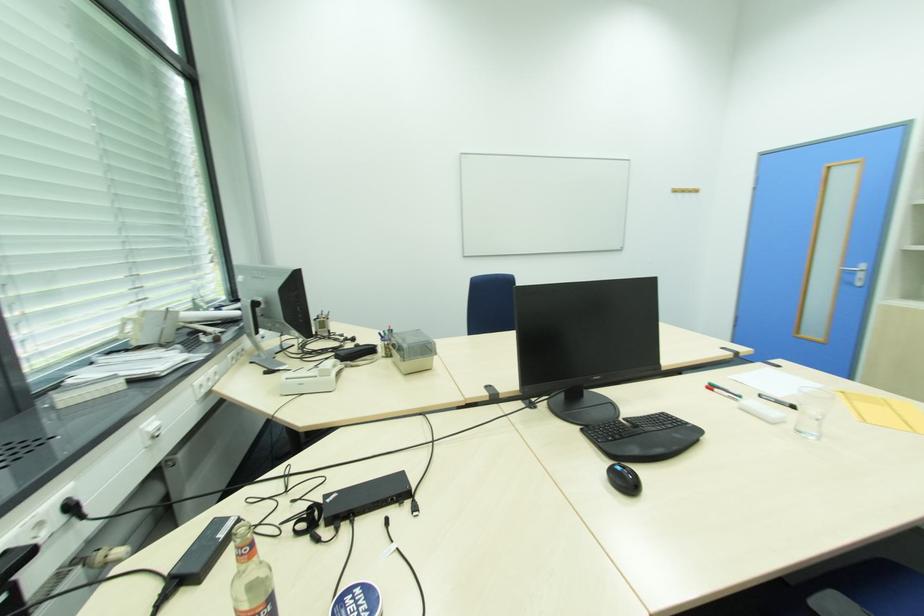
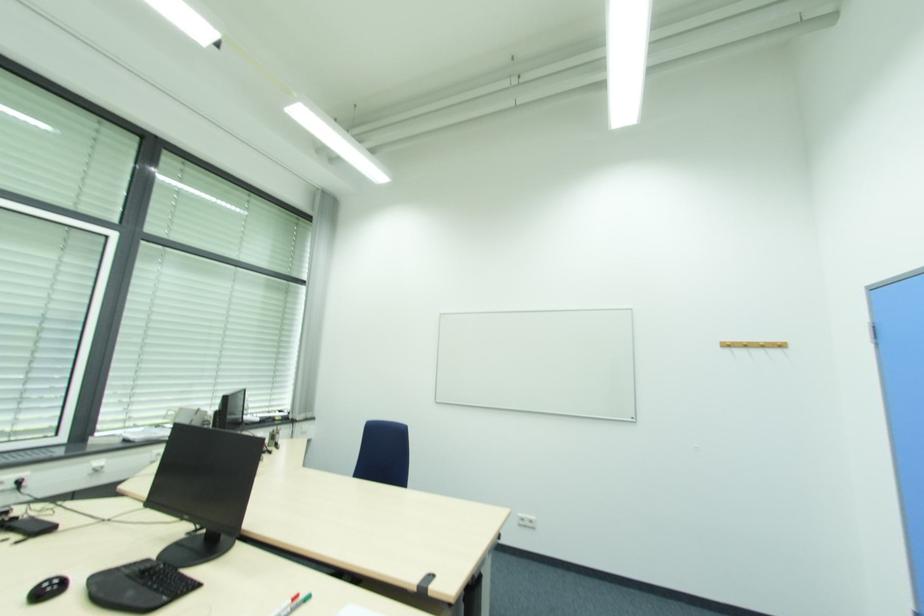
Find the pixel in the second image that matches (x=687, y=192) in the first image.

(748, 346)